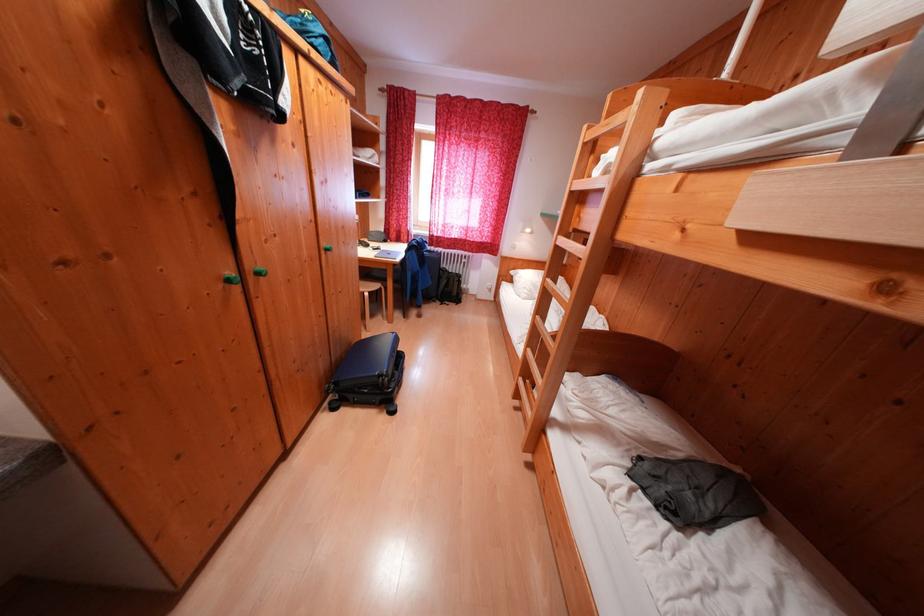
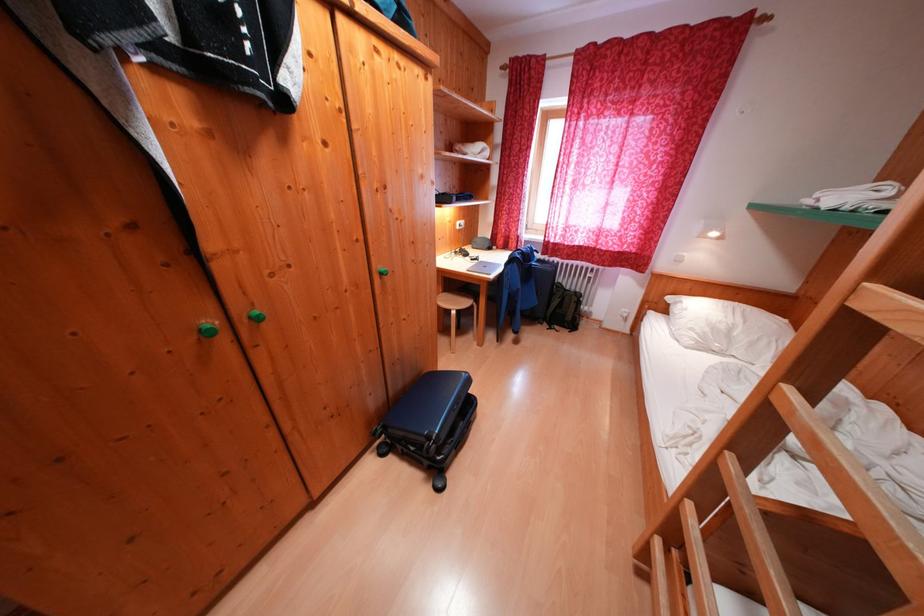
Question: Which direction would the cameraman need to move to produce the second image? Reply with the corresponding letter.

Choices:
 (A) Left
 (B) Right
 (C) Forward
 (D) Backward

Answer: (C)